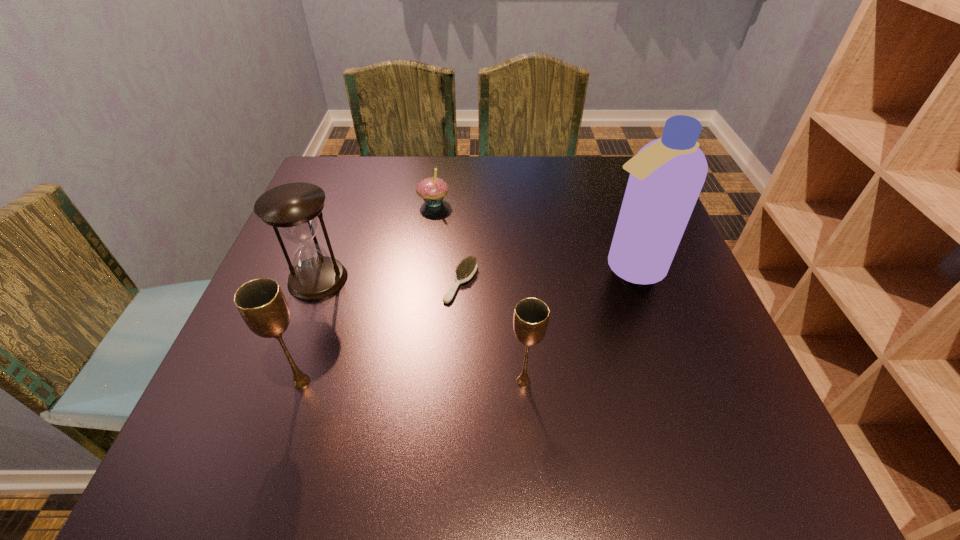
You are a GUI agent. You are given a task and a screenshot of the screen. Output one action in this format:
    pyautogui.click(x=<x>, y=<y>)
    Task: Click on the taller chalice
    This screenshot has width=960, height=540.
    Given the screenshot: What is the action you would take?
    pyautogui.click(x=261, y=303)

Where is `the right chalice`? This screenshot has width=960, height=540. the right chalice is located at coordinates (531, 315).

Where is `the second object from right to left`? This screenshot has height=540, width=960. the second object from right to left is located at coordinates (531, 315).

I want to click on cupcake, so point(432,190).

Where is `the farthest object`? This screenshot has width=960, height=540. the farthest object is located at coordinates (432, 190).

At what (x,y) coordinates should I click in order to perform the action: click on hourglass. Please return your answer as a coordinate pair (x, y). The image size is (960, 540). Looking at the image, I should click on (294, 208).

Locate an element on the screen. The image size is (960, 540). the rightmost object is located at coordinates (666, 176).

Where is `the tallest object`? the tallest object is located at coordinates (666, 176).

Locate an element on the screen. the third object from right to left is located at coordinates (465, 271).

You are a GUI agent. You are given a task and a screenshot of the screen. Output one action in this format:
    pyautogui.click(x=<x>, y=<y>)
    Task: Click on the shortest object
    The width and height of the screenshot is (960, 540).
    Given the screenshot: What is the action you would take?
    (465, 271)